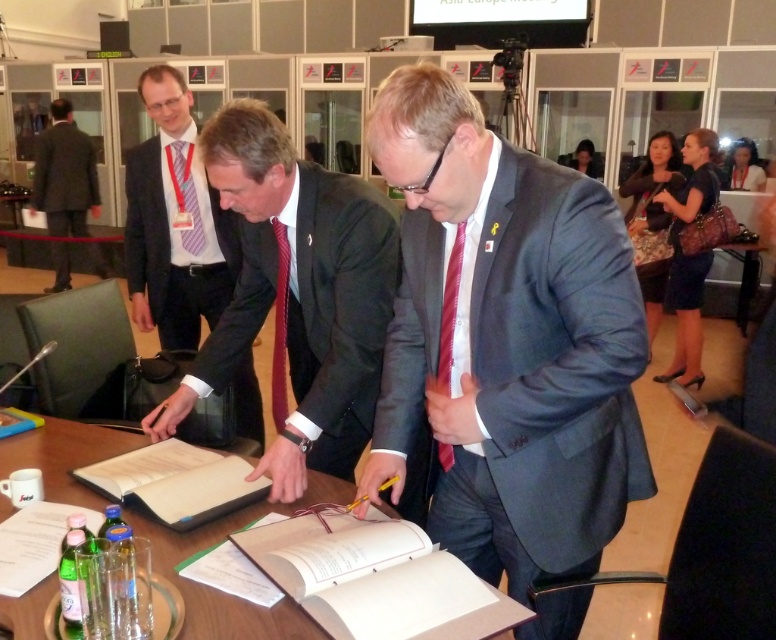
Question: Among these points, which one is nearest to the camera?

Choices:
 (A) (442, 300)
 (B) (236, 412)
 (C) (487, 385)
 (D) (307, 428)

Answer: (C)

Question: Observing the image, what is the correct spatial positioning of dark gray suit at left in reference to maroon silk tie at center?

Choices:
 (A) above
 (B) below

Answer: (A)

Question: Can you confirm if matte black suit at center is positioned above striped fabric tie at center?

Choices:
 (A) no
 (B) yes

Answer: (A)

Question: Which point appears closest to the camera in this image?

Choices:
 (A) (182, 234)
 (B) (379, 321)
 (C) (286, 417)

Answer: (B)

Question: Can you confirm if dark gray suit at upper left is bigger than white paper clipboard at center?

Choices:
 (A) yes
 (B) no

Answer: (A)

Question: Which object is the closest to the matte black suit at center?

Choices:
 (A) maroon silk tie at center
 (B) striped fabric tie at center

Answer: (A)